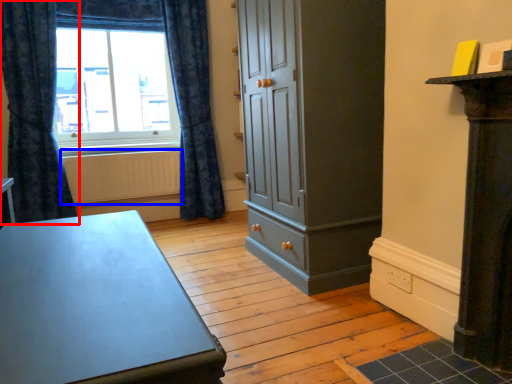
Question: Among these objects, which one is farthest to the camera, curtain (highlighted by a red box) or radiator (highlighted by a blue box)?

Choices:
 (A) curtain
 (B) radiator

Answer: (B)